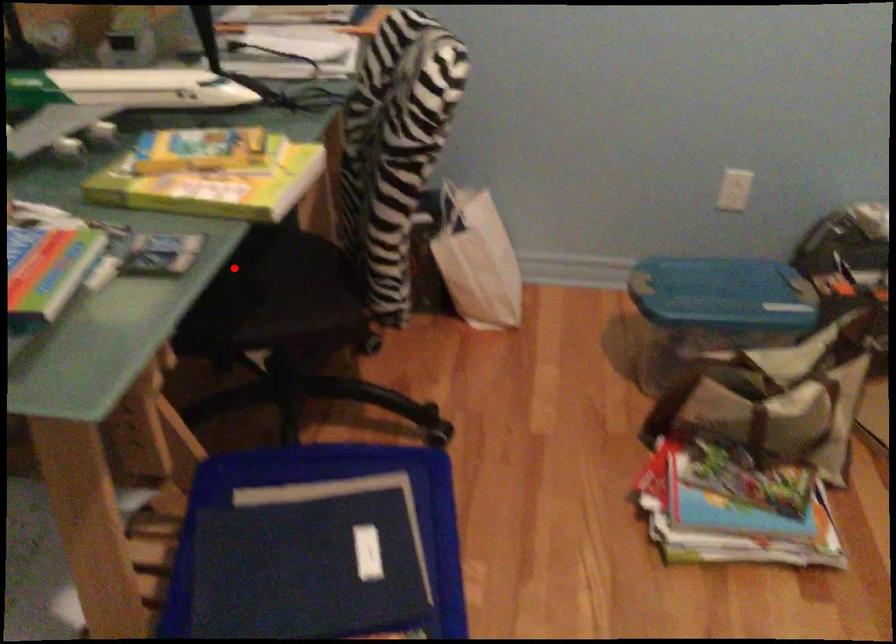
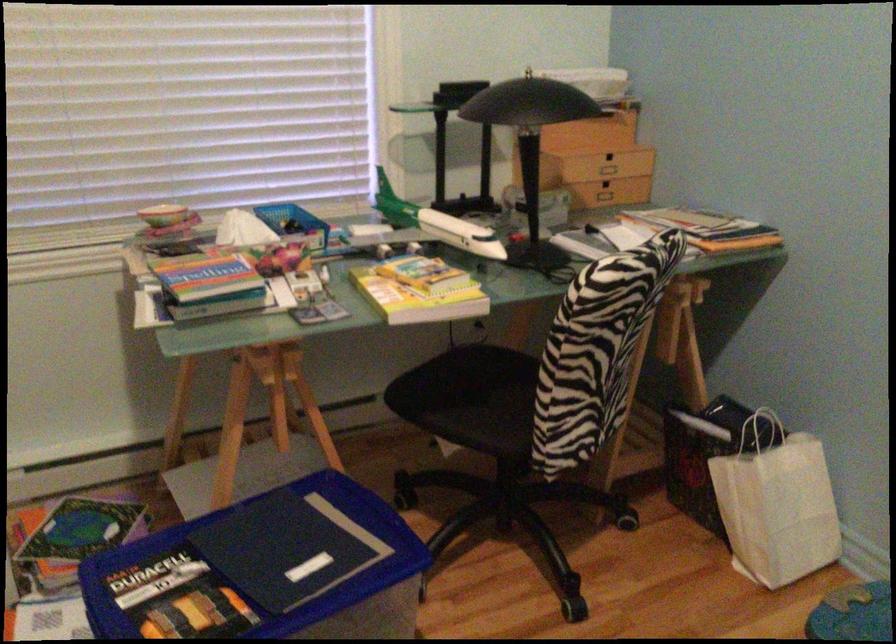
Question: I am providing you with two images of the same scene from different viewpoints. A red point is shown in image1. For the corresponding object point in image2, is it positioned nearer or farther from the camera?

Choices:
 (A) Nearer
 (B) Farther

Answer: (B)